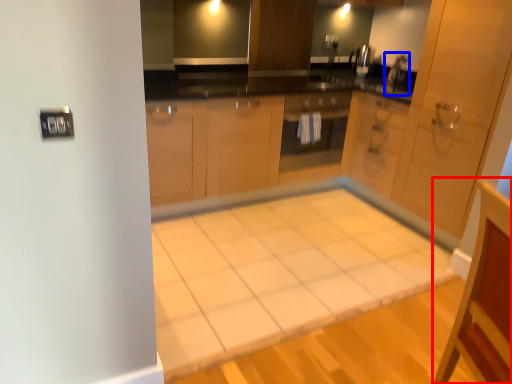
Question: Which object is closer to the camera taking this photo, vanity (highlighted by a red box) or faucet (highlighted by a blue box)?

Choices:
 (A) vanity
 (B) faucet

Answer: (A)